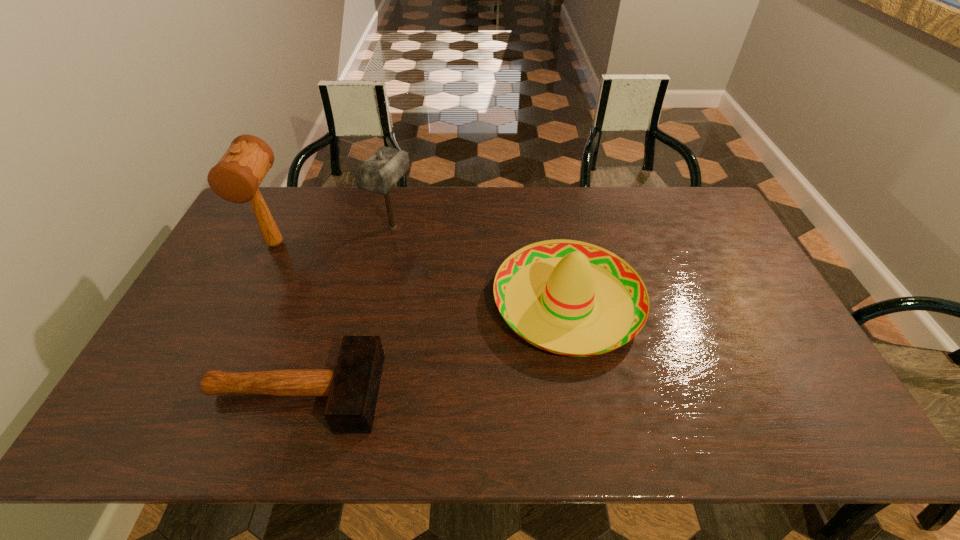
Locate an element on the screen. vacant position at the near edge of the desktop is located at coordinates (266, 408).

This screenshot has height=540, width=960. Find the location of `free region at the left edge of the desktop`. free region at the left edge of the desktop is located at coordinates (248, 295).

The image size is (960, 540). In the image, there is a desktop. Identify the location of blank space at the far left corner. (276, 187).

Locate an element on the screen. This screenshot has width=960, height=540. vacant space at the near left corner is located at coordinates click(167, 444).

Image resolution: width=960 pixels, height=540 pixels. Identify the location of vacant region at the far right corner of the desktop. (692, 221).

Image resolution: width=960 pixels, height=540 pixels. Identify the location of empty location between the second shortest object and the nearest mallet. (431, 348).

Select which object is the third closest to the shortest mallet. Please provide its 2D coordinates. Your answer should be formatted as a tuple, i.e. [(x, y)], where the tuple contains the x and y coordinates of a point satisfying the conditions above.

[(379, 173)]

I want to click on the third closest object to the sombrero, so click(236, 177).

Find the location of `mallet that stands as the second closest to the rightmost object`. mallet that stands as the second closest to the rightmost object is located at coordinates (352, 387).

Locate which mallet ranks in proximity to the shortest mallet. Please provide its 2D coordinates. Your answer should be formatted as a tuple, i.e. [(x, y)], where the tuple contains the x and y coordinates of a point satisfying the conditions above.

[(236, 177)]